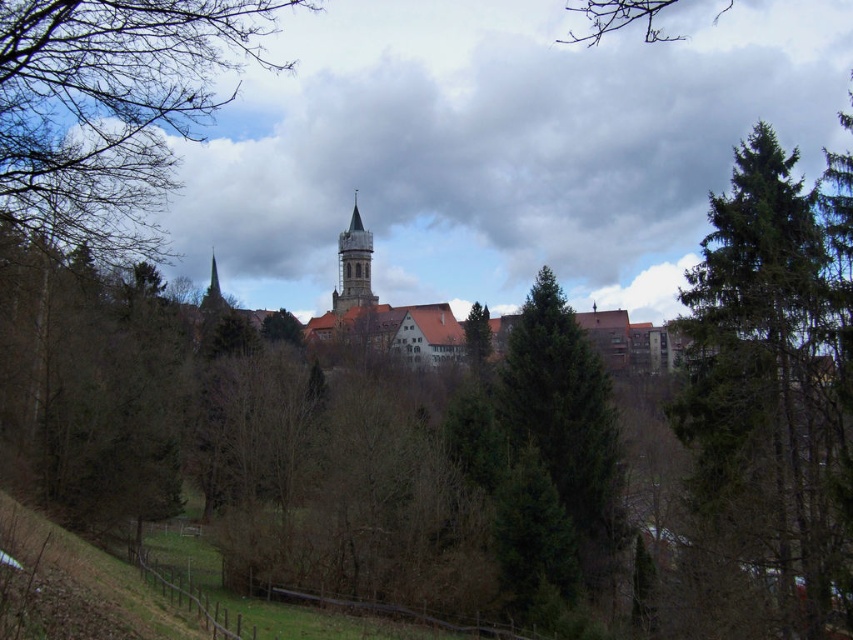
Question: Which object is closer to the camera taking this photo?

Choices:
 (A) green matte tree at center
 (B) green needle-like tree at right
 (C) smooth gray stone tower at center
 (D) brown leafless branches at upper left

Answer: (D)

Question: Considering the relative positions of smooth gray stone tower at center and green matte tree at center in the image provided, where is smooth gray stone tower at center located with respect to green matte tree at center?

Choices:
 (A) right
 (B) left

Answer: (B)

Question: Does brown leafless branches at upper left appear under green matte tree at center?

Choices:
 (A) yes
 (B) no

Answer: (B)

Question: Which of the following is the closest to the observer?

Choices:
 (A) brown leafless branches at upper left
 (B) smooth gray stone tower at center
 (C) green needle-like tree at right

Answer: (A)

Question: Based on their relative distances, which object is farther from the green needle-like tree at right?

Choices:
 (A) green matte tree at center
 (B) brown leafless branches at upper left
 (C) smooth gray stone tower at center

Answer: (C)

Question: In this image, where is green needle-like tree at right located relative to smooth gray stone tower at center?

Choices:
 (A) above
 (B) below

Answer: (B)